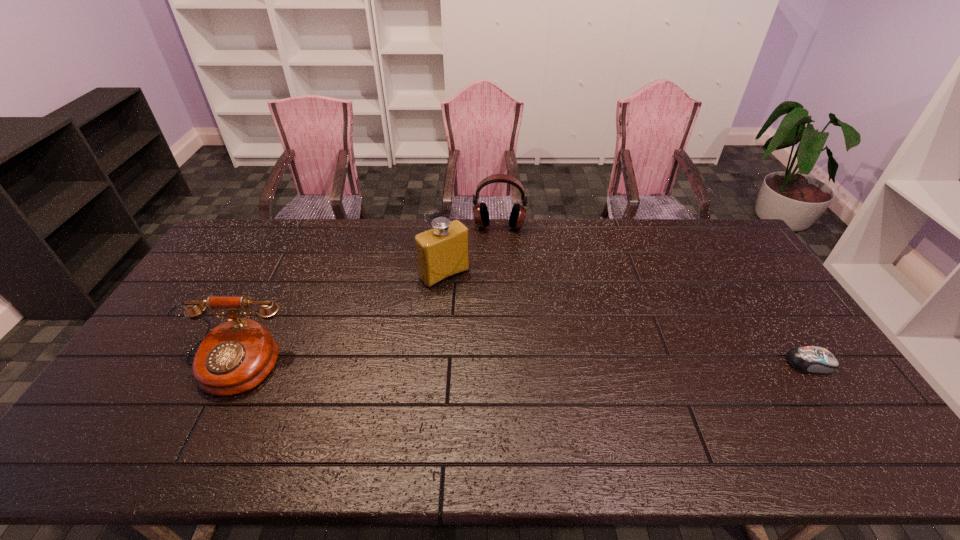
Locate an element on the screen. The width and height of the screenshot is (960, 540). the leftmost object is located at coordinates (234, 357).

Locate an element on the screen. This screenshot has width=960, height=540. the rightmost object is located at coordinates (808, 359).

Find the location of a particular element. The width and height of the screenshot is (960, 540). the shortest object is located at coordinates pyautogui.click(x=808, y=359).

Image resolution: width=960 pixels, height=540 pixels. Identify the location of the farthest object. (480, 211).

The width and height of the screenshot is (960, 540). I want to click on headset, so click(480, 211).

In order to click on the third nearest object in this screenshot , I will do `click(442, 252)`.

Locate an element on the screen. the second object from left to right is located at coordinates (442, 252).

Where is `vacant region located 0.330m on the ear pads of the headset`? The width and height of the screenshot is (960, 540). vacant region located 0.330m on the ear pads of the headset is located at coordinates (495, 296).

You are a GUI agent. You are given a task and a screenshot of the screen. Output one action in this format:
    pyautogui.click(x=<x>, y=<y>)
    Task: Click on the free space located on the ear pads of the headset
    The height and width of the screenshot is (540, 960).
    Given the screenshot: What is the action you would take?
    pyautogui.click(x=497, y=248)

At what (x,y) coordinates should I click in order to perform the action: click on vacant region located on the ear pads of the headset. Please return your answer as a coordinate pair (x, y). The height and width of the screenshot is (540, 960). Looking at the image, I should click on (497, 242).